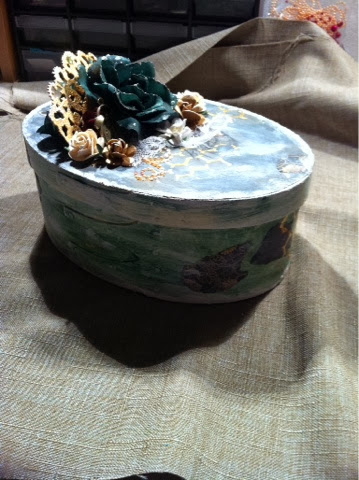
The image size is (359, 480). I want to click on fabric, so 340,214.